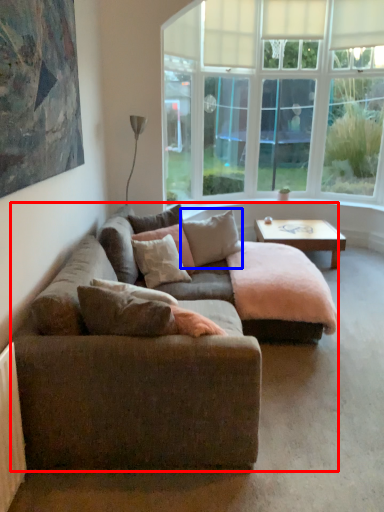
Question: Which object is closer to the camera taking this photo, studio couch (highlighted by a red box) or pillow (highlighted by a blue box)?

Choices:
 (A) studio couch
 (B) pillow

Answer: (A)